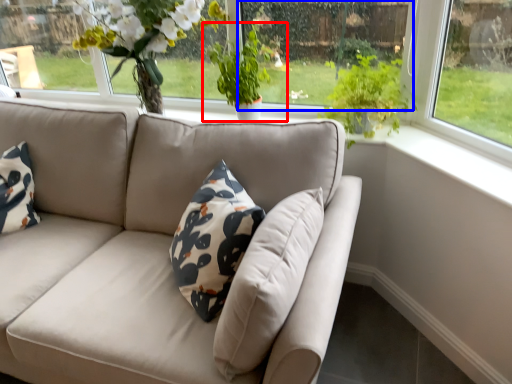
Question: Which object is further to the camera taking this photo, houseplant (highlighted by a red box) or window screen (highlighted by a blue box)?

Choices:
 (A) houseplant
 (B) window screen

Answer: (A)